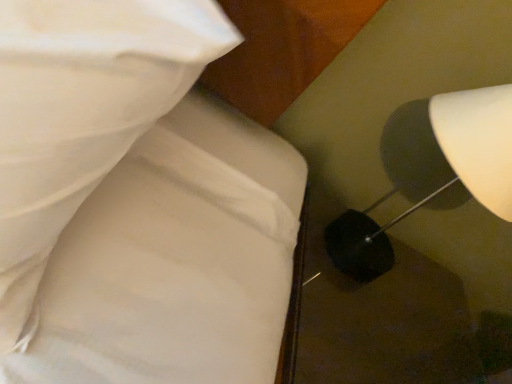
The height and width of the screenshot is (384, 512). What do you see at coordinates (445, 183) in the screenshot? I see `white glossy lampshade at right` at bounding box center [445, 183].

Where is `white glossy lampshade at right`? white glossy lampshade at right is located at coordinates (445, 183).

Image resolution: width=512 pixels, height=384 pixels. What do you see at coordinates (136, 201) in the screenshot? I see `white fabric bed at upper left` at bounding box center [136, 201].

Find the location of a particular element. white fabric bed at upper left is located at coordinates (136, 201).

This screenshot has width=512, height=384. Identify the location of white glossy lampshade at right. tap(445, 183).

Considering the relative positions of white fabric bed at upper left and white glossy lampshade at right in the image provided, is white fabric bed at upper left to the left of white glossy lampshade at right from the viewer's perspective?

Yes.

Is the depth of white fabric bed at upper left less than that of white glossy lampshade at right?

Yes, white fabric bed at upper left is in front of white glossy lampshade at right.

Does point (208, 271) appear closer or farther from the camera than point (483, 205)?

Clearly, point (208, 271) is closer to the camera than point (483, 205).

From the image's perspective, relative to white glossy lampshade at right, is white fabric bed at upper left above or below?

From the image's perspective, white fabric bed at upper left appears below white glossy lampshade at right.

From a real-world perspective, is white fabric bed at upper left positioned over white glossy lampshade at right based on gravity?

Correct, in the physical world, white fabric bed at upper left is higher than white glossy lampshade at right.

Between white fabric bed at upper left and white glossy lampshade at right, which one has larger width?

Wider between the two is white fabric bed at upper left.

Is white fabric bed at upper left taller than white glossy lampshade at right?

Correct, white fabric bed at upper left is much taller as white glossy lampshade at right.

Is white fabric bed at upper left smaller than white glossy lampshade at right?

Correct, white fabric bed at upper left occupies less space than white glossy lampshade at right.

Is white glossy lampshade at right a part of white fabric bed at upper left?

Definitely not — white glossy lampshade at right is not inside white fabric bed at upper left.

Is white fabric bed at upper left far from white glossy lampshade at right?

No, white fabric bed at upper left is not far away from white glossy lampshade at right.

Is white fabric bed at upper left looking in the opposite direction of white glossy lampshade at right?

No, white fabric bed at upper left is not facing away from white glossy lampshade at right.

Locate an element on the screen. Image resolution: width=512 pixels, height=384 pixels. bed above the white glossy lampshade at right (from a real-world perspective) is located at coordinates (136, 201).

Based on their positions, is white glossy lampshade at right located to the left or right of white fabric bed at upper left?

Based on their positions, white glossy lampshade at right is located to the right of white fabric bed at upper left.

Is the position of white glossy lampshade at right less distant than that of white fabric bed at upper left?

No, it is not.

Is point (336, 232) closer or farther from the camera than point (134, 210)?

Point (336, 232) appears to be farther away from the viewer than point (134, 210).

Consider the image. From the image's perspective, who appears lower, white glossy lampshade at right or white fabric bed at upper left?

From the image's view, white fabric bed at upper left is below.

From a real-world perspective, who is located higher, white glossy lampshade at right or white fabric bed at upper left?

white fabric bed at upper left, from a real-world perspective.

Between white glossy lampshade at right and white fabric bed at upper left, which one has smaller width?

With smaller width is white glossy lampshade at right.

Is white glossy lampshade at right shorter than white fabric bed at upper left?

Yes.

Considering the relative sizes of white glossy lampshade at right and white fabric bed at upper left in the image provided, is white glossy lampshade at right smaller than white fabric bed at upper left?

No, white glossy lampshade at right is not smaller than white fabric bed at upper left.

Which is correct: white glossy lampshade at right is inside white fabric bed at upper left, or outside of it?

white glossy lampshade at right cannot be found inside white fabric bed at upper left.

Is white glossy lampshade at right far from white fabric bed at upper left?

No, white glossy lampshade at right is not far from white fabric bed at upper left.

Is white glossy lampshade at right aimed at white fabric bed at upper left?

No, white glossy lampshade at right does not turn towards white fabric bed at upper left.

What's the angular difference between white glossy lampshade at right and white fabric bed at upper left's facing directions?

4.48 degrees separate the facing orientations of white glossy lampshade at right and white fabric bed at upper left.

Where is `lamp above the white fabric bed at upper left (from the image's perspective)`? lamp above the white fabric bed at upper left (from the image's perspective) is located at coordinates (445, 183).

Where is `bed that appears above the white glossy lampshade at right (from a real-world perspective)`? bed that appears above the white glossy lampshade at right (from a real-world perspective) is located at coordinates [136, 201].

You are a GUI agent. You are given a task and a screenshot of the screen. Output one action in this format:
    pyautogui.click(x=<x>, y=<y>)
    Task: Click on the lamp behind the white fabric bed at upper left
    
    Given the screenshot: What is the action you would take?
    pyautogui.click(x=445, y=183)